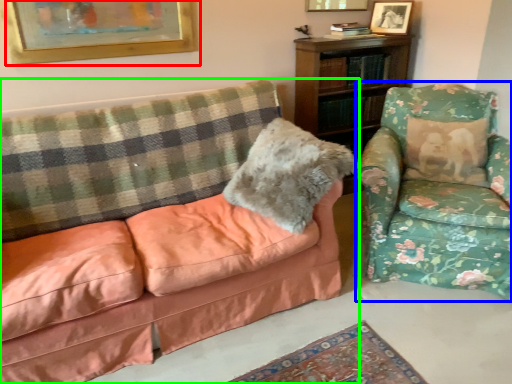
Question: Which is nearer to the picture frame (highlighted by a red box)? chair (highlighted by a blue box) or studio couch (highlighted by a green box).

Choices:
 (A) chair
 (B) studio couch

Answer: (B)